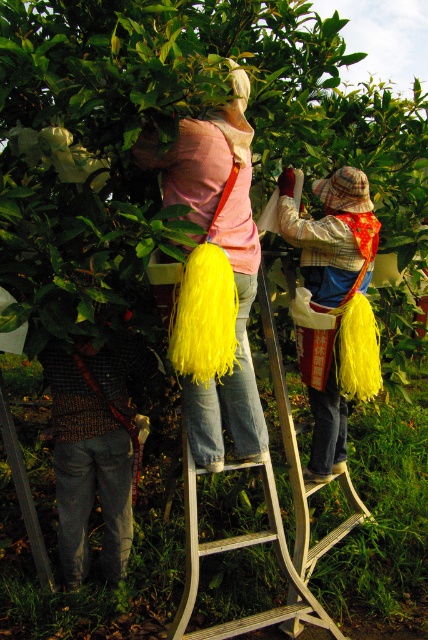
Question: Which point is closer to the camera?

Choices:
 (A) yellow fabric bag at center
 (B) pink fabric bag at center

Answer: (B)

Question: Where is pink fabric bag at center located in relation to yellow fabric bag at center in the image?

Choices:
 (A) below
 (B) above

Answer: (B)

Question: In this image, where is yellow fabric bag at center located relative to metallic silver ladder at center?

Choices:
 (A) below
 (B) above

Answer: (B)

Question: Based on their relative distances, which object is farther from the metallic silver ladder at center?

Choices:
 (A) yellow fabric bag at center
 (B) pink fabric bag at center

Answer: (B)

Question: Can you confirm if pink fabric bag at center is positioned to the right of metallic silver ladder at center?

Choices:
 (A) yes
 (B) no

Answer: (B)

Question: Which object appears farthest from the camera in this image?

Choices:
 (A) metallic silver ladder at center
 (B) yellow fabric bag at center

Answer: (B)